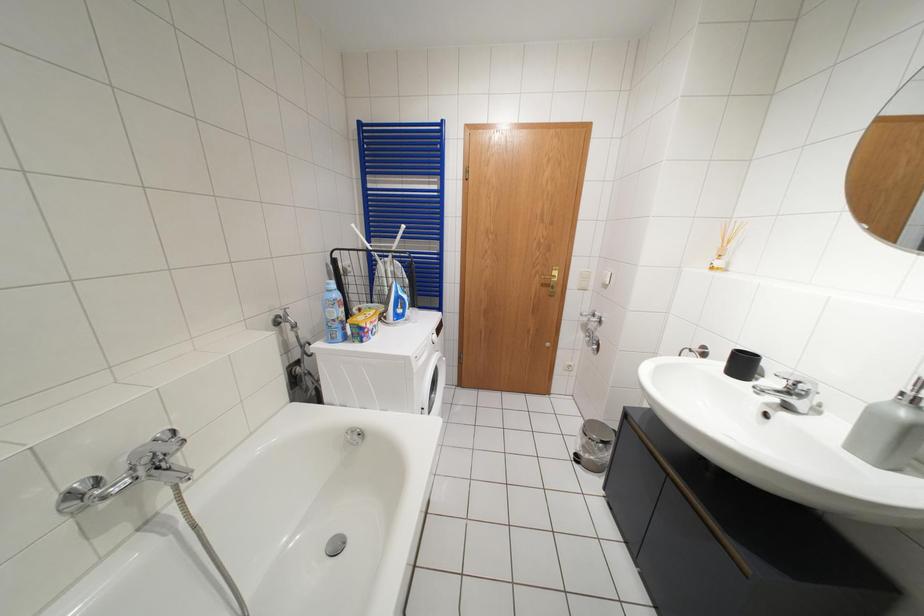
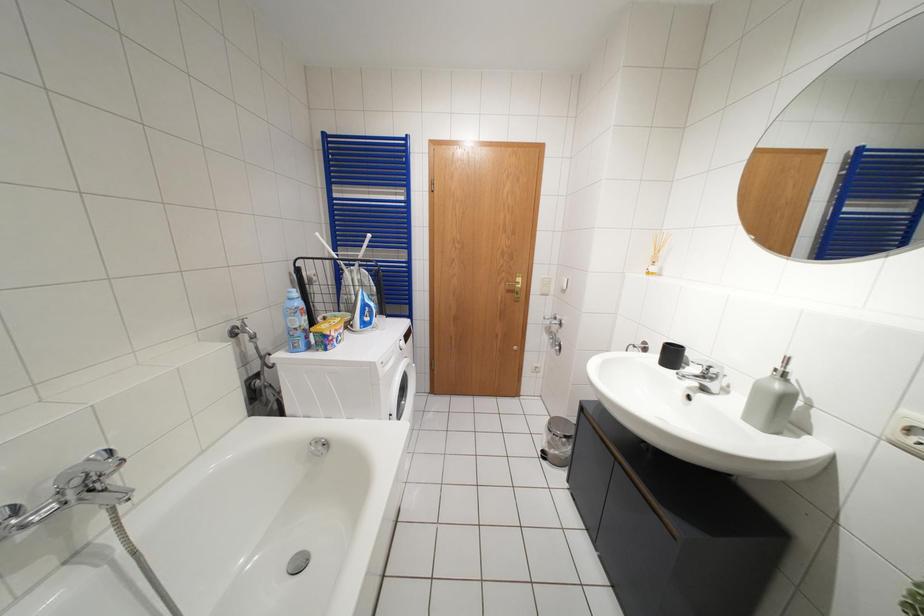
Question: How did the camera likely rotate?

Choices:
 (A) Left
 (B) Right
 (C) Up
 (D) Down

Answer: (B)